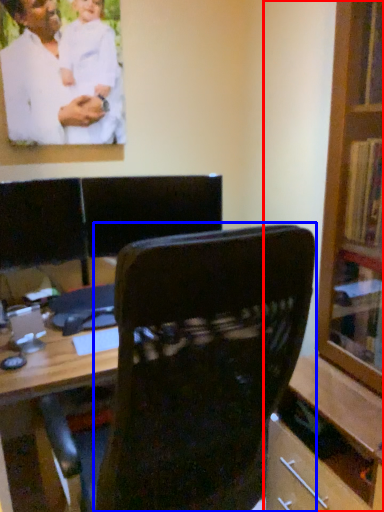
Question: Which point is further to the camera, bookcase (highlighted by a red box) or chair (highlighted by a blue box)?

Choices:
 (A) bookcase
 (B) chair

Answer: (A)